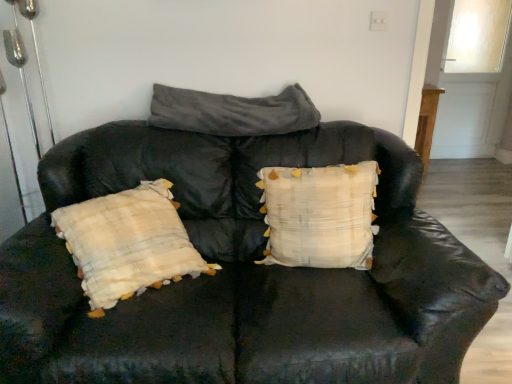
Question: Does white textured pillow at center, the 2th pillow viewed from the top, come behind gray fuzzy blanket at upper center, positioned as the second pillow in bottom-to-top order?

Choices:
 (A) yes
 (B) no

Answer: (B)

Question: Considering the relative positions of white textured pillow at center, which is the first pillow in bottom-to-top order, and gray fuzzy blanket at upper center, positioned as the second pillow in bottom-to-top order, in the image provided, is white textured pillow at center, which is the first pillow in bottom-to-top order, to the right of gray fuzzy blanket at upper center, positioned as the second pillow in bottom-to-top order, from the viewer's perspective?

Choices:
 (A) no
 (B) yes

Answer: (B)

Question: From the image's perspective, would you say white textured pillow at center, which is the first pillow in bottom-to-top order, is shown under gray fuzzy blanket at upper center, positioned as the second pillow in bottom-to-top order?

Choices:
 (A) yes
 (B) no

Answer: (A)

Question: Considering the relative sizes of white textured pillow at center, the 2th pillow viewed from the top, and gray fuzzy blanket at upper center, the 1th pillow when ordered from top to bottom, in the image provided, is white textured pillow at center, the 2th pillow viewed from the top, taller than gray fuzzy blanket at upper center, the 1th pillow when ordered from top to bottom,?

Choices:
 (A) yes
 (B) no

Answer: (A)

Question: Is gray fuzzy blanket at upper center, positioned as the second pillow in bottom-to-top order, completely or partially inside white textured pillow at center, the 2th pillow viewed from the top?

Choices:
 (A) yes
 (B) no

Answer: (B)

Question: Is white textured pillow at center, the 2th pillow viewed from the top, directly adjacent to gray fuzzy blanket at upper center, positioned as the second pillow in bottom-to-top order?

Choices:
 (A) no
 (B) yes

Answer: (A)

Question: Is gray fuzzy blanket at upper center, the 1th pillow when ordered from top to bottom, beside white textured pillow at center, the 2th pillow viewed from the top?

Choices:
 (A) no
 (B) yes

Answer: (A)

Question: Does gray fuzzy blanket at upper center, positioned as the second pillow in bottom-to-top order, have a lesser width compared to white textured pillow at center, which is the first pillow in bottom-to-top order?

Choices:
 (A) no
 (B) yes

Answer: (A)

Question: Is gray fuzzy blanket at upper center, the 1th pillow when ordered from top to bottom, outside of white textured pillow at center, the 2th pillow viewed from the top?

Choices:
 (A) yes
 (B) no

Answer: (A)

Question: Does gray fuzzy blanket at upper center, positioned as the second pillow in bottom-to-top order, have a smaller size compared to white textured pillow at center, the 2th pillow viewed from the top?

Choices:
 (A) no
 (B) yes

Answer: (B)

Question: Considering the relative sizes of gray fuzzy blanket at upper center, the 1th pillow when ordered from top to bottom, and white textured pillow at center, the 2th pillow viewed from the top, in the image provided, is gray fuzzy blanket at upper center, the 1th pillow when ordered from top to bottom, shorter than white textured pillow at center, the 2th pillow viewed from the top,?

Choices:
 (A) no
 (B) yes

Answer: (B)

Question: Does gray fuzzy blanket at upper center, positioned as the second pillow in bottom-to-top order, appear on the left side of white textured pillow at center, the 2th pillow viewed from the top?

Choices:
 (A) yes
 (B) no

Answer: (A)

Question: Is point (362, 243) closer or farther from the camera than point (210, 114)?

Choices:
 (A) farther
 (B) closer

Answer: (B)